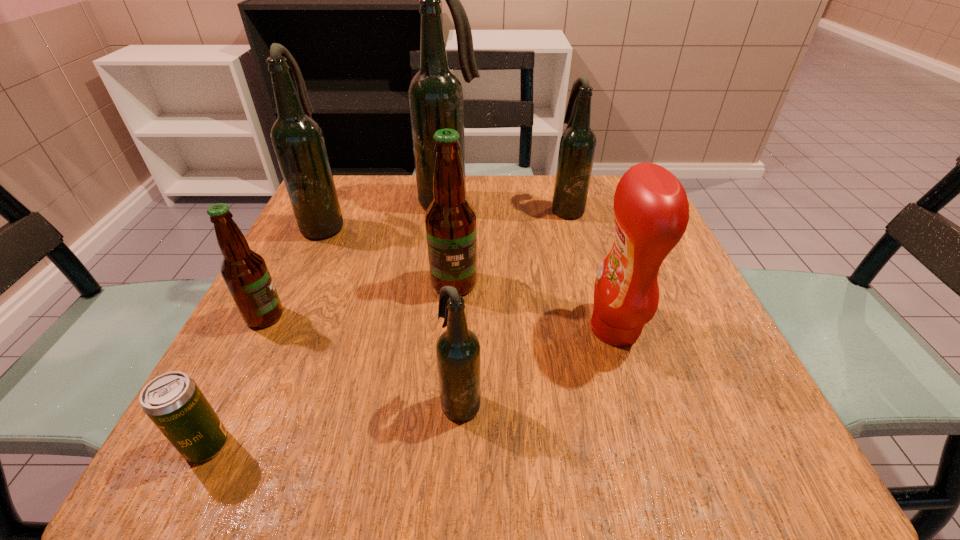
At what (x,y) coordinates should I click in order to perform the action: click on blank region between the red condiment and the biggest dark beer bottle. Please return your answer as a coordinate pair (x, y). Image resolution: width=960 pixels, height=540 pixels. Looking at the image, I should click on (532, 266).

Find the location of a particular element. The height and width of the screenshot is (540, 960). unoccupied area between the second nearest object and the second smallest dark beer bottle is located at coordinates (515, 305).

What are the coordinates of `unoccupied position between the leftmost dark beer bottle and the bigger brown beer bottle` in the screenshot? It's located at (390, 254).

You are a GUI agent. You are given a task and a screenshot of the screen. Output one action in this format:
    pyautogui.click(x=<x>, y=<y>)
    Task: Click on the free point between the third biggest dark beer bottle and the bigger brown beer bottle
    Image resolution: width=960 pixels, height=540 pixels.
    Given the screenshot: What is the action you would take?
    pyautogui.click(x=511, y=246)

Identify the location of free spot between the farther brown beer bottle and the third biggest dark beer bottle. The image size is (960, 540). (511, 246).

Where is `vacant area between the tallest object and the beer can`? The image size is (960, 540). vacant area between the tallest object and the beer can is located at coordinates (x=328, y=323).

Where is `empty location between the smallest dark beer bottle and the condiment`? empty location between the smallest dark beer bottle and the condiment is located at coordinates (538, 365).

Select which object is the third closest to the rightmost dark beer bottle. Please provide its 2D coordinates. Your answer should be formatted as a tuple, i.e. [(x, y)], where the tuple contains the x and y coordinates of a point satisfying the conditions above.

[(651, 210)]

Identify the location of object that ranks as the sixth closest to the tallest beer bottle. (458, 352).

Where is `beer bottle that stands as the second closest to the smaller brown beer bottle`? This screenshot has width=960, height=540. beer bottle that stands as the second closest to the smaller brown beer bottle is located at coordinates (450, 220).